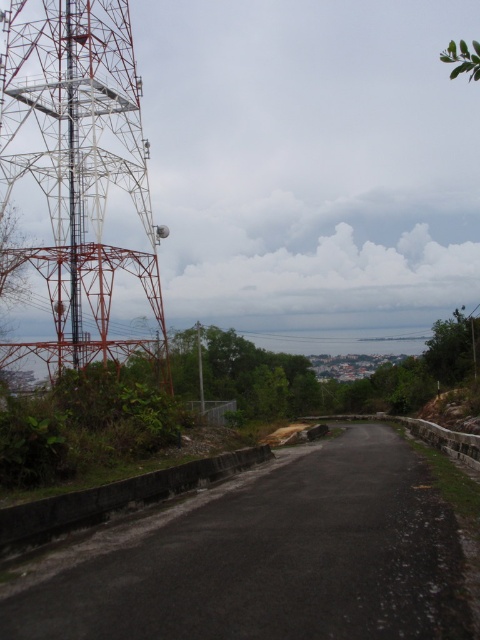
Between point (94, 84) and point (200, 355), which one is positioned behind?

Point (200, 355)

The height and width of the screenshot is (640, 480). Identify the location of metallic lattice tower at left. (78, 170).

Locate an element on the screen. This screenshot has width=480, height=640. metallic lattice tower at left is located at coordinates (78, 170).